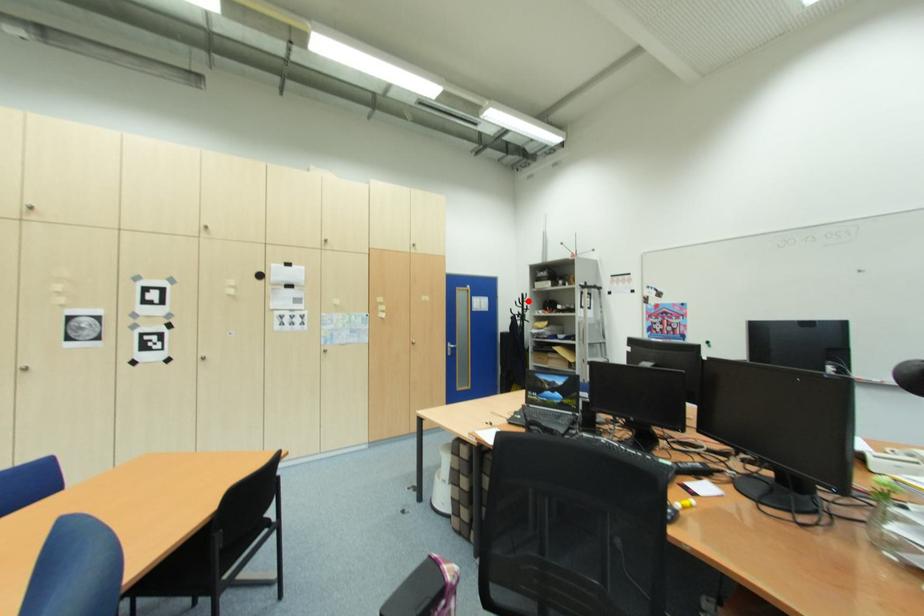
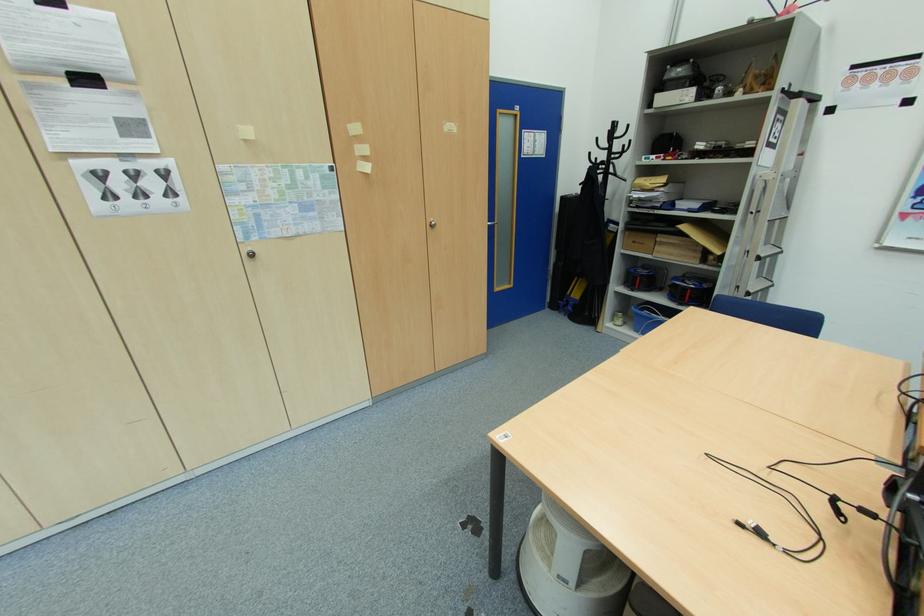
Find the pixel in the second image that matches the highlighted location in the first image.

(619, 136)